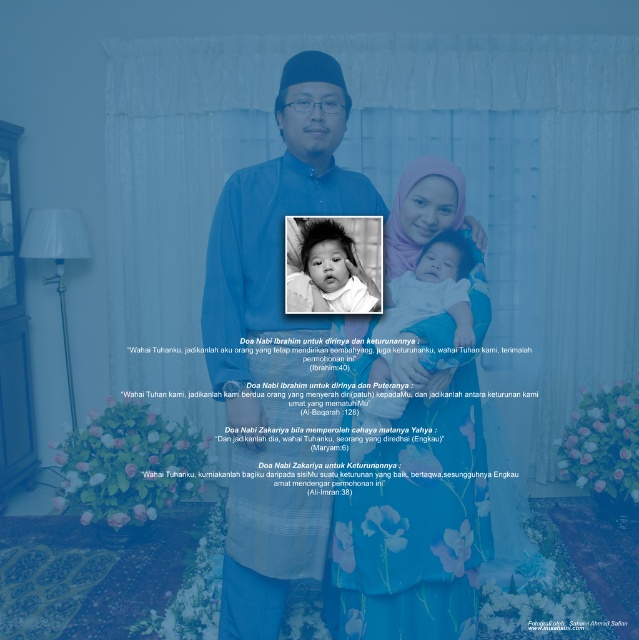
Question: Does black and white baby at center have a larger size compared to smooth white baby at center?

Choices:
 (A) yes
 (B) no

Answer: (A)

Question: Which object is farther from the camera taking this photo?

Choices:
 (A) black and white baby at center
 (B) matte purple hijab at center

Answer: (A)

Question: Does matte purple hijab at center appear under smooth white baby at center?

Choices:
 (A) no
 (B) yes

Answer: (B)

Question: Which object is farther from the camera taking this photo?

Choices:
 (A) matte blue shirt at center
 (B) black and white baby at center
 (C) smooth white baby at center
 (D) matte purple hijab at center

Answer: (A)

Question: Is matte blue shirt at center smaller than black and white baby at center?

Choices:
 (A) yes
 (B) no

Answer: (B)

Question: Considering the real-world distances, which object is farthest from the black and white baby at center?

Choices:
 (A) smooth white baby at center
 (B) matte blue shirt at center
 (C) matte purple hijab at center

Answer: (B)